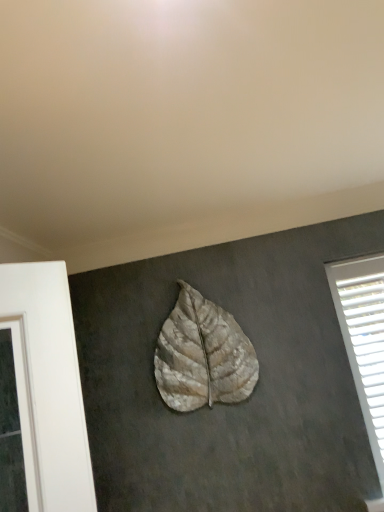
The height and width of the screenshot is (512, 384). What are the coordinates of `textured beige leaf at center` in the screenshot? It's located at (203, 355).

What do you see at coordinates (203, 355) in the screenshot?
I see `textured beige leaf at center` at bounding box center [203, 355].

The width and height of the screenshot is (384, 512). Describe the element at coordinates (364, 339) in the screenshot. I see `white plastic blinds at right` at that location.

The width and height of the screenshot is (384, 512). Identify the location of white plastic blinds at right. (364, 339).

Identify the location of textured beige leaf at center. (203, 355).

From the picture: Which object is positioned more to the right, textured beige leaf at center or white plastic blinds at right?

Positioned to the right is white plastic blinds at right.

Between textured beige leaf at center and white plastic blinds at right, which one is positioned behind?

Positioned behind is white plastic blinds at right.

Considering the positions of point (189, 338) and point (353, 293), is point (189, 338) closer or farther from the camera than point (353, 293)?

Point (189, 338) is closer to the camera than point (353, 293).

From the image's perspective, is textured beige leaf at center located above white plastic blinds at right?

Yes, from the image's perspective, textured beige leaf at center is above white plastic blinds at right.

From a real-world perspective, is textured beige leaf at center beneath white plastic blinds at right?

Incorrect, from a real-world perspective, textured beige leaf at center is higher than white plastic blinds at right.

Does textured beige leaf at center have a greater width compared to white plastic blinds at right?

Yes, textured beige leaf at center is wider than white plastic blinds at right.

Which of these two, textured beige leaf at center or white plastic blinds at right, stands shorter?

Standing shorter between the two is textured beige leaf at center.

Considering the sizes of objects textured beige leaf at center and white plastic blinds at right in the image provided, who is smaller, textured beige leaf at center or white plastic blinds at right?

Smaller between the two is white plastic blinds at right.

Is textured beige leaf at center not within white plastic blinds at right?

textured beige leaf at center is positioned outside white plastic blinds at right.

Are textured beige leaf at center and white plastic blinds at right far apart?

No, textured beige leaf at center is not far from white plastic blinds at right.

Is textured beige leaf at center looking in the opposite direction of white plastic blinds at right?

No, textured beige leaf at center is not facing the opposite direction of white plastic blinds at right.

How many degrees apart are the facing directions of textured beige leaf at center and white plastic blinds at right?

0.00466 degrees.

You are a GUI agent. You are given a task and a screenshot of the screen. Output one action in this format:
    pyautogui.click(x=<x>, y=<y>)
    Task: Click on the leaf above the white plastic blinds at right (from the image's perspective)
    
    Given the screenshot: What is the action you would take?
    pyautogui.click(x=203, y=355)

Considering the relative positions of white plastic blinds at right and textured beige leaf at center in the image provided, is white plastic blinds at right to the left or to the right of textured beige leaf at center?

From the image, it's evident that white plastic blinds at right is to the right of textured beige leaf at center.

Which object is further away from the camera taking this photo, white plastic blinds at right or textured beige leaf at center?

white plastic blinds at right is more distant.

Does point (356, 276) come in front of point (246, 353)?

No, (356, 276) is further to viewer.

From the image's perspective, is white plastic blinds at right on top of textured beige leaf at center?

No, from the image's perspective, white plastic blinds at right is not on top of textured beige leaf at center.

Based on the photo, from a real-world perspective, who is located higher, white plastic blinds at right or textured beige leaf at center?

textured beige leaf at center, from a real-world perspective.

Considering the sizes of white plastic blinds at right and textured beige leaf at center in the image, is white plastic blinds at right wider or thinner than textured beige leaf at center?

Clearly, white plastic blinds at right has less width compared to textured beige leaf at center.

Between white plastic blinds at right and textured beige leaf at center, which one has more height?

With more height is white plastic blinds at right.

Looking at this image, is white plastic blinds at right smaller than textured beige leaf at center?

Correct, white plastic blinds at right occupies less space than textured beige leaf at center.

Based on the photo, do you think white plastic blinds at right is within textured beige leaf at center, or outside of it?

white plastic blinds at right is outside textured beige leaf at center.

Would you say white plastic blinds at right is a long distance from textured beige leaf at center?

white plastic blinds at right is near textured beige leaf at center, not far away.

Is white plastic blinds at right looking in the opposite direction of textured beige leaf at center?

No, white plastic blinds at right is not facing away from textured beige leaf at center.

In the scene shown: How many degrees apart are the facing directions of white plastic blinds at right and textured beige leaf at center?

0.00466 degrees separate the facing orientations of white plastic blinds at right and textured beige leaf at center.

Identify the location of window that is behind the textured beige leaf at center. (364, 339).

Where is `leaf above the white plastic blinds at right (from the image's perspective)`? leaf above the white plastic blinds at right (from the image's perspective) is located at coordinates (203, 355).

The image size is (384, 512). I want to click on window that is on the right side of textured beige leaf at center, so click(x=364, y=339).